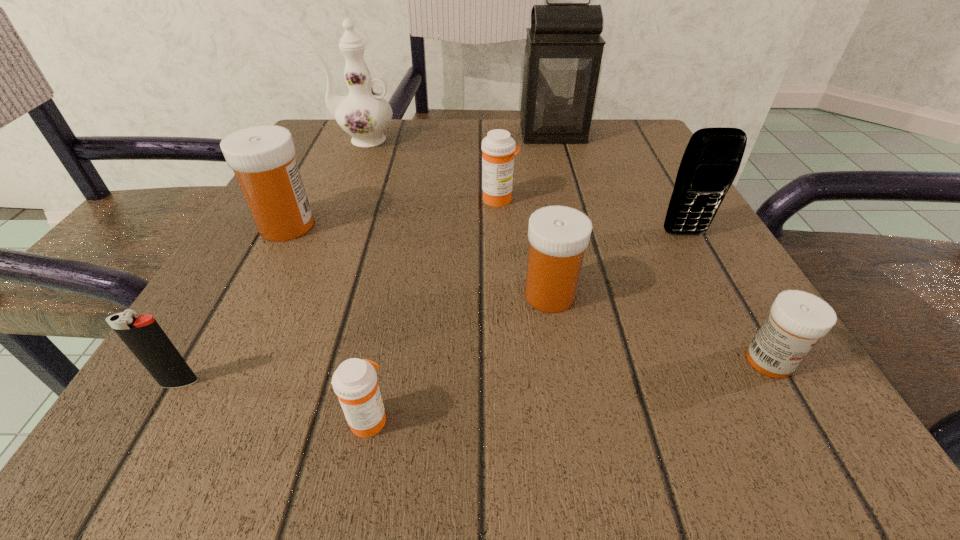
This screenshot has width=960, height=540. I want to click on free location that satisfies the following two spatial constraints: 1. on the front-facing side of the lantern; 2. at the spout of the chinaware, so click(x=555, y=140).